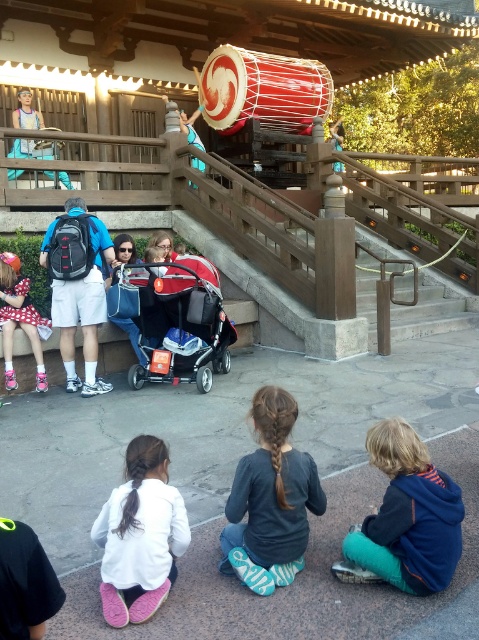
Question: Is blue fleece jacket at lower right thinner than red leather drum at upper center?

Choices:
 (A) no
 (B) yes

Answer: (B)

Question: In this image, where is red matte baby carriage at center located relative to matte pink dress at lower left?

Choices:
 (A) above
 (B) below

Answer: (B)

Question: Can you confirm if white fuzzy socks at lower left is positioned below matte blue pants at upper left?

Choices:
 (A) no
 (B) yes

Answer: (B)

Question: Which point is closer to the camera taking this photo?

Choices:
 (A) (21, 112)
 (B) (187, 124)
 (C) (150, 493)

Answer: (C)

Question: Considering the real-world distances, which object is farthest from the white fuzzy socks at lower left?

Choices:
 (A) blue fleece jacket at lower right
 (B) red matte baby carriage at center
 (C) dark gray shirt at center
 (D) matte pink dress at lower left

Answer: (D)

Question: Among these points, which one is nearest to the camera?

Choices:
 (A) (114, 554)
 (B) (270, 563)

Answer: (A)